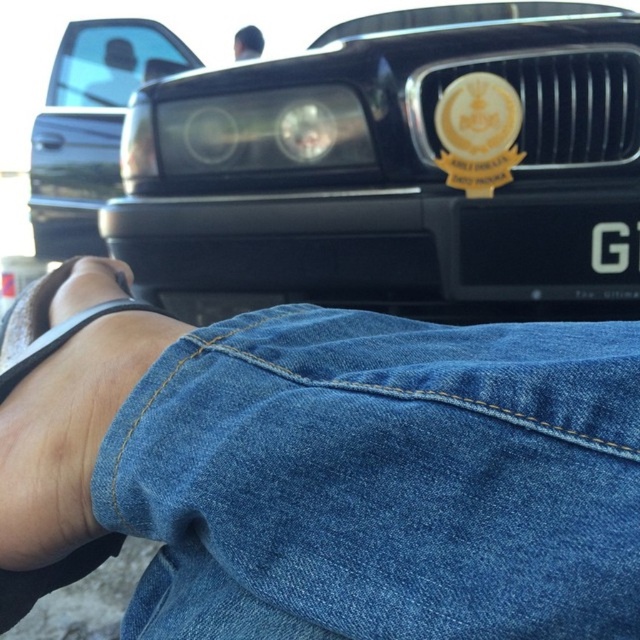
You are a delivery person who needs to attach a 10 cm long sticker to the license plate. The sticker must be placed exactly at the center of the license plate. However, you are currently holding a measuring tape and can only measure distances between objects. Given that you can see the black glossy bumper at center and the black plastic license plate at center, can you determine if the sticker will fit perfectly at the center of the license plate without overlapping the bumper?

The black glossy bumper at center and black plastic license plate at center are 10.87 centimeters apart. Since the sticker is 10 cm long and the distance between them is greater than the sticker length, the sticker can be placed at the center of the license plate without overlapping the bumper.

You are a driver trying to park your car in a narrow alley. You see the glossy black car at upper left and the matte black car at upper left in the image. Which car should you avoid parking next to if you want to leave enough space for your vehicle?

You should avoid parking next to the glossy black car at upper left because its width is larger than the matte black car at upper left, requiring more space.

You are sitting in a car and looking at two cars parked in front of you. Which one is more to the left side between the glossy black car at upper left and the matte black car at upper left?

The glossy black car at upper left is positioned on the left side of matte black car at upper left, so it is more to the left side.